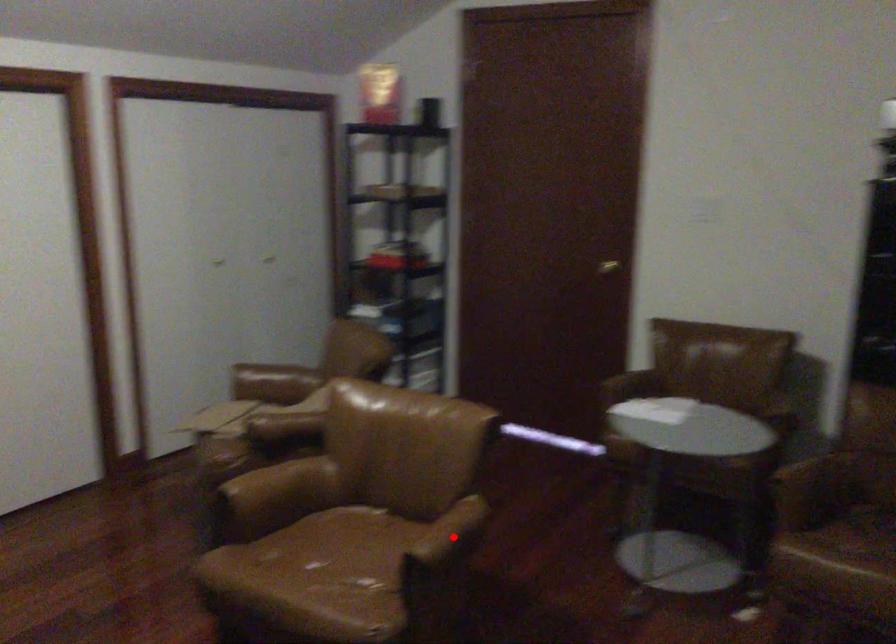
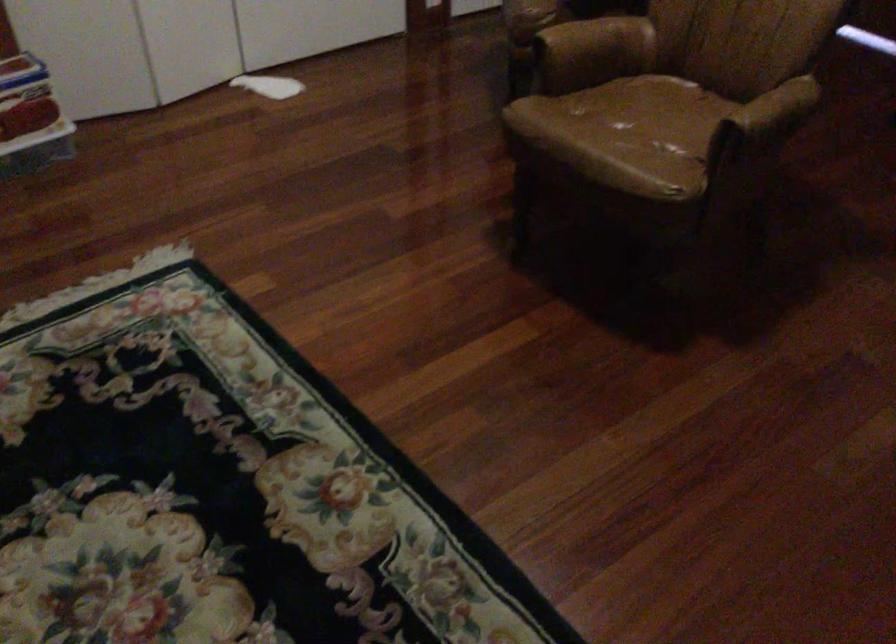
Locate, in the second image, the point that corresponds to the highlighted location in the first image.

(776, 109)